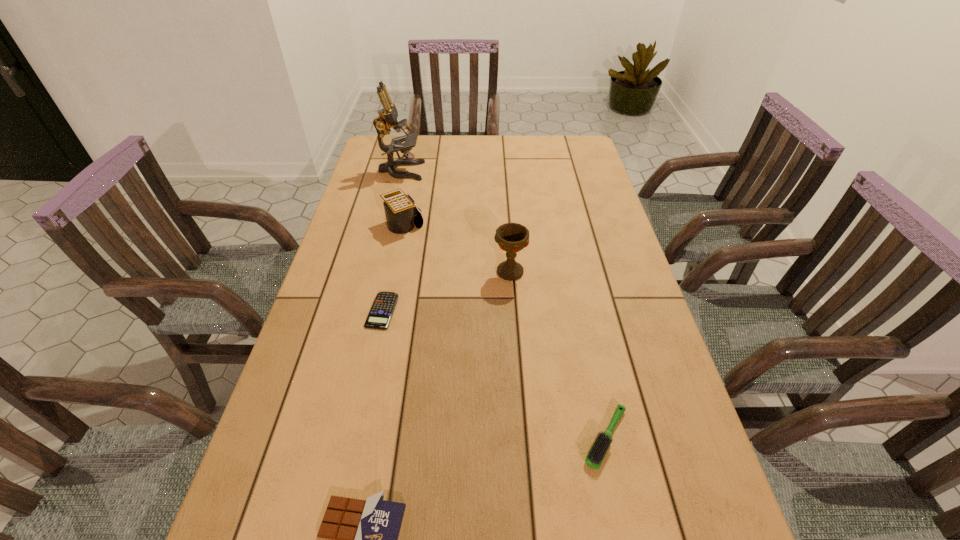
Where is `microscope`? The image size is (960, 540). microscope is located at coordinates (387, 118).

The image size is (960, 540). I want to click on the tallest object, so click(387, 118).

Find the location of `the fifth object from left to right`. the fifth object from left to right is located at coordinates (511, 237).

Where is `chalice`? chalice is located at coordinates (511, 237).

Image resolution: width=960 pixels, height=540 pixels. Identify the location of the taller calculator. (402, 217).

The width and height of the screenshot is (960, 540). I want to click on the fourth shortest object, so click(402, 217).

The image size is (960, 540). Find the location of `hairbrush`. hairbrush is located at coordinates (597, 451).

At what (x,y) coordinates should I click in order to perform the action: click on the rightmost object. Please return your answer as a coordinate pair (x, y). This screenshot has width=960, height=540. Looking at the image, I should click on (597, 451).

Locate an element on the screen. This screenshot has height=540, width=960. the fourth farthest object is located at coordinates [381, 312].

This screenshot has height=540, width=960. What are the coordinates of `the shortest object` in the screenshot? It's located at (381, 312).